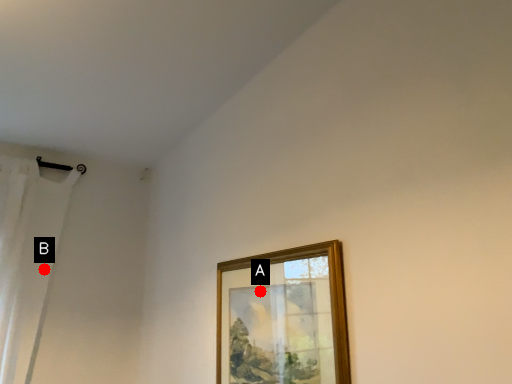
Question: Two points are circled on the image, labeled by A and B beside each circle. Which of the following is the farthest from the observer?

Choices:
 (A) A is further
 (B) B is further

Answer: (B)